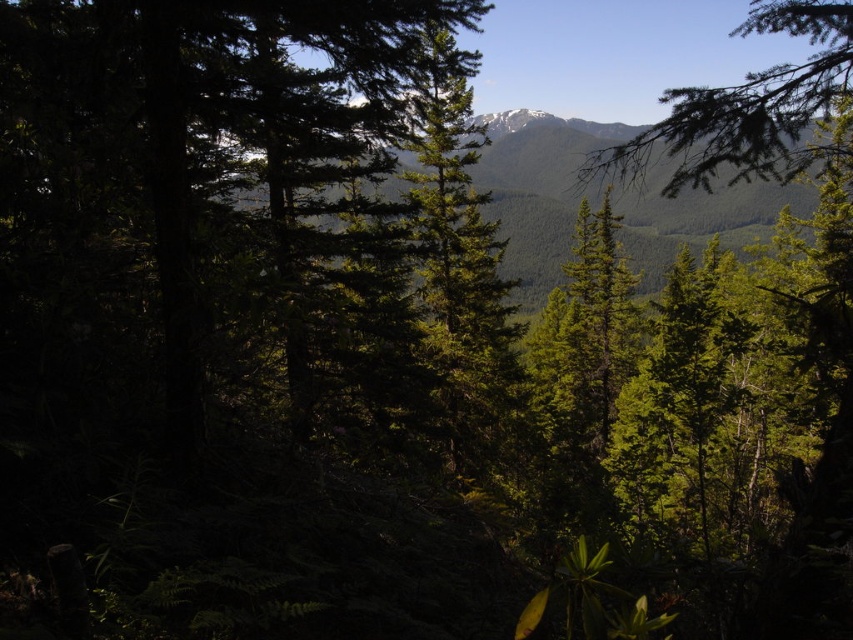
Question: Which of the following is the farthest from the observer?

Choices:
 (A) green matte tree branch at upper right
 (B) green textured mountain at center

Answer: (B)

Question: Does green textured mountain at center have a greater width compared to green matte tree branch at upper right?

Choices:
 (A) yes
 (B) no

Answer: (B)

Question: Which of the following is the closest to the observer?

Choices:
 (A) (653, 285)
 (B) (753, 170)

Answer: (B)

Question: Where is green textured mountain at center located in relation to green matte tree branch at upper right in the image?

Choices:
 (A) above
 (B) below

Answer: (B)

Question: Does green textured mountain at center appear on the left side of green matte tree branch at upper right?

Choices:
 (A) no
 (B) yes

Answer: (B)